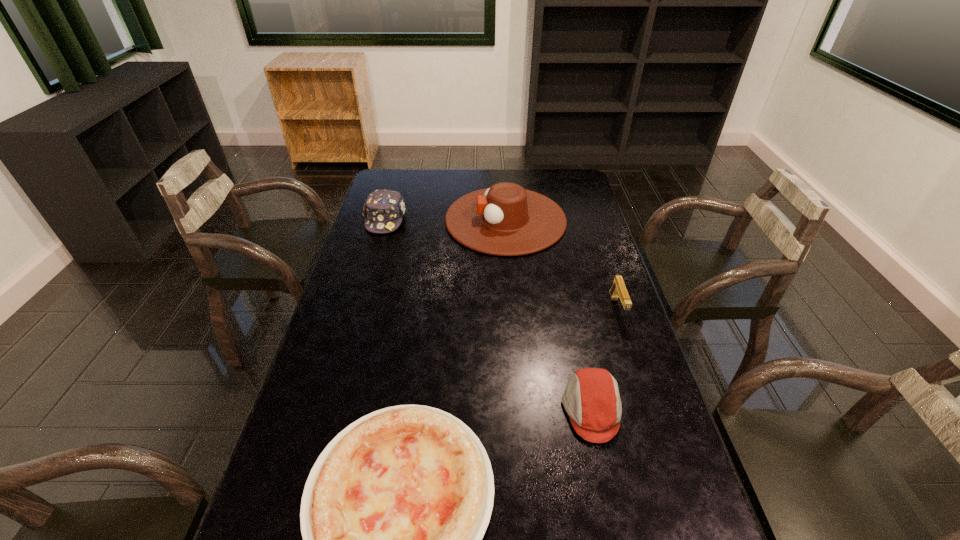
Find the location of a particular element. This screenshot has height=540, width=960. vacant space situated 0.170m at the barrel of the pistol is located at coordinates (x=638, y=374).

I want to click on free location located 0.080m on the front-facing side of the nearer cap, so click(x=530, y=409).

Where is `vacant area situated on the front-facing side of the nearer cap`? This screenshot has height=540, width=960. vacant area situated on the front-facing side of the nearer cap is located at coordinates (493, 409).

The image size is (960, 540). Identify the location of vacant region located on the front-facing side of the nearer cap. (485, 409).

Locate an element on the screen. object that is at the far edge is located at coordinates click(506, 220).

I want to click on object located in the left edge section of the desktop, so click(x=383, y=209).

You are a GUI agent. You are given a task and a screenshot of the screen. Output one action in this format:
    pyautogui.click(x=<x>, y=<y>)
    Task: Click on the cowboy hat located in the right edge section of the desktop
    The image size is (960, 540).
    Given the screenshot: What is the action you would take?
    pyautogui.click(x=506, y=220)

Image resolution: width=960 pixels, height=540 pixels. Find the location of `pistol that is at the right edge`. pistol that is at the right edge is located at coordinates (618, 289).

Locate an element on the screen. cap located in the right edge section of the desktop is located at coordinates (591, 399).

Find the location of a particular element. object positioned at the far right corner is located at coordinates (506, 220).